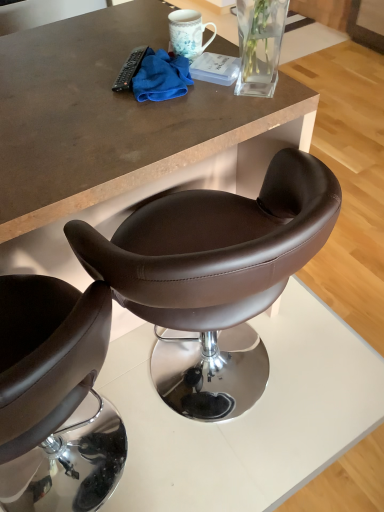
Question: Is blue microfiber cloth at upper center in front of or behind matte brown leather stool at center in the image?

Choices:
 (A) front
 (B) behind

Answer: (B)

Question: From the image's perspective, relative to matte brown leather stool at center, is blue microfiber cloth at upper center above or below?

Choices:
 (A) below
 (B) above

Answer: (B)

Question: Estimate the real-world distances between objects in this image. Which object is farther from the black plastic remote control at upper center?

Choices:
 (A) blue microfiber cloth at upper center
 (B) brown leather chair at center
 (C) matte brown leather stool at center

Answer: (B)

Question: Which is farther from the brown leather chair at center?

Choices:
 (A) matte brown leather stool at center
 (B) blue microfiber cloth at upper center
 (C) black plastic remote control at upper center

Answer: (C)